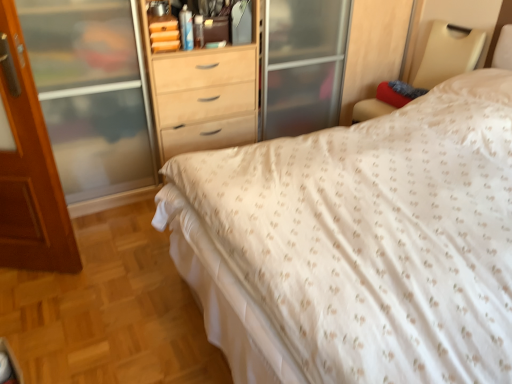
What do you see at coordinates (447, 55) in the screenshot? I see `white fabric bed frame at upper right` at bounding box center [447, 55].

What do you see at coordinates (374, 47) in the screenshot? I see `matte wood dresser at center` at bounding box center [374, 47].

You are a GUI agent. You are given a task and a screenshot of the screen. Output one action in this format:
    pyautogui.click(x=<x>, y=<y>)
    Task: Click on the white fabric bed frame at upper right
    
    Given the screenshot: What is the action you would take?
    (x=447, y=55)

Does white textured bed at center contain brown wooden door at left?

No, brown wooden door at left is not surrounded by white textured bed at center.

Does white textured bed at center have a greater width compared to brown wooden door at left?

Yes.

From the image's perspective, who appears lower, white textured bed at center or brown wooden door at left?

white textured bed at center.

Does white textured bed at center touch brown wooden door at left?

white textured bed at center is not next to brown wooden door at left, and they're not touching.

This screenshot has width=512, height=384. In order to click on dresser above the white fabric bed frame at upper right (from the image's perspective) in this screenshot , I will do `click(374, 47)`.

Looking at this image, is white fabric bed frame at upper right looking in the opposite direction of matte wood dresser at center?

white fabric bed frame at upper right does not have its back to matte wood dresser at center.

Who is more distant, white fabric bed frame at upper right or matte wood dresser at center?

white fabric bed frame at upper right is more distant.

Can you confirm if white fabric bed frame at upper right is bigger than matte wood dresser at center?

Incorrect, white fabric bed frame at upper right is not larger than matte wood dresser at center.

Which object is thinner, matte wood dresser at center or white fabric bed frame at upper right?

white fabric bed frame at upper right is thinner.

I want to click on bed frame below the matte wood dresser at center (from the image's perspective), so click(x=447, y=55).

Is there a large distance between matte wood dresser at center and white fabric bed frame at upper right?

No.

How far apart are matte wood dresser at center and white fabric bed frame at upper right?

The distance of matte wood dresser at center from white fabric bed frame at upper right is 39.00 centimeters.

Would you say brown wooden door at left is inside or outside matte wood dresser at center?

brown wooden door at left is not inside matte wood dresser at center, it's outside.

In the scene shown: From the image's perspective, is brown wooden door at left located beneath matte wood dresser at center?

Yes, from the image's perspective, brown wooden door at left is beneath matte wood dresser at center.

Is brown wooden door at left turned away from matte wood dresser at center?

Yes, matte wood dresser at center is at the back of brown wooden door at left.

Locate an element on the screen. dresser located on the right of brown wooden door at left is located at coordinates (374, 47).

Measure the distance from white textured bed at center to white fabric bed frame at upper right.

white textured bed at center and white fabric bed frame at upper right are 4.61 feet apart.

Locate an element on the screen. bed frame behind the white textured bed at center is located at coordinates (447, 55).

Is point (389, 225) positioned before point (441, 65)?

Yes, point (389, 225) is in front of point (441, 65).

Can you confirm if white textured bed at center is thinner than white fabric bed frame at upper right?

Incorrect, the width of white textured bed at center is not less than that of white fabric bed frame at upper right.

Between white fabric bed frame at upper right and white textured bed at center, which one has smaller width?

Thinner between the two is white fabric bed frame at upper right.

Identify the location of bed frame on the right of white textured bed at center. Image resolution: width=512 pixels, height=384 pixels. (447, 55).

Consider the image. What's the angular difference between white fabric bed frame at upper right and white textured bed at center's facing directions?

white fabric bed frame at upper right and white textured bed at center are facing 0.00163 degrees away from each other.

Who is bigger, white fabric bed frame at upper right or white textured bed at center?

Bigger between the two is white textured bed at center.

Does brown wooden door at left have a greater height compared to white textured bed at center?

Correct, brown wooden door at left is much taller as white textured bed at center.

Does point (65, 248) appear closer or farther from the camera than point (432, 373)?

Clearly, point (65, 248) is more distant from the camera than point (432, 373).

Considering the relative positions of brown wooden door at left and white textured bed at center in the image provided, is brown wooden door at left to the left or to the right of white textured bed at center?

In the image, brown wooden door at left appears on the left side of white textured bed at center.

From the picture: Who is bigger, brown wooden door at left or white textured bed at center?

Bigger between the two is white textured bed at center.

Locate an element on the screen. This screenshot has height=384, width=512. door on the left of white textured bed at center is located at coordinates (29, 168).

Where is `dresser in front of the white fabric bed frame at upper right`? This screenshot has height=384, width=512. dresser in front of the white fabric bed frame at upper right is located at coordinates (374, 47).

Estimate the real-world distances between objects in this image. Which object is closer to white fabric bed frame at upper right, matte wood dresser at center or white textured bed at center?

Among the two, matte wood dresser at center is located nearer to white fabric bed frame at upper right.

Considering their positions, is brown wooden door at left positioned closer to white fabric bed frame at upper right than matte wood dresser at center?

The object closer to white fabric bed frame at upper right is matte wood dresser at center.

Looking at the image, which one is located closer to matte wood dresser at center, brown wooden door at left or white textured bed at center?

white textured bed at center is closer to matte wood dresser at center.

Based on their spatial positions, is white textured bed at center or white fabric bed frame at upper right further from matte wood dresser at center?

Among the two, white textured bed at center is located further to matte wood dresser at center.

Estimate the real-world distances between objects in this image. Which object is closer to white textured bed at center, matte wood dresser at center or brown wooden door at left?

Among the two, brown wooden door at left is located nearer to white textured bed at center.

From the image, which object appears to be nearer to brown wooden door at left, white textured bed at center or white fabric bed frame at upper right?

→ The object closer to brown wooden door at left is white textured bed at center.

Which object lies nearer to the anchor point brown wooden door at left, white textured bed at center or matte wood dresser at center?

The object closer to brown wooden door at left is white textured bed at center.

Which object lies nearer to the anchor point brown wooden door at left, white fabric bed frame at upper right or matte wood dresser at center?

Based on the image, matte wood dresser at center appears to be nearer to brown wooden door at left.

The height and width of the screenshot is (384, 512). I want to click on dresser positioned between white textured bed at center and white fabric bed frame at upper right from near to far, so click(x=374, y=47).

The height and width of the screenshot is (384, 512). What are the coordinates of `dresser located between brown wooden door at left and white textured bed at center in the left-right direction` in the screenshot? It's located at (374, 47).

Locate an element on the screen. bed between brown wooden door at left and white fabric bed frame at upper right from left to right is located at coordinates (358, 244).

Where is `dresser located between brown wooden door at left and white fabric bed frame at upper right in the left-right direction`? This screenshot has height=384, width=512. dresser located between brown wooden door at left and white fabric bed frame at upper right in the left-right direction is located at coordinates (374, 47).